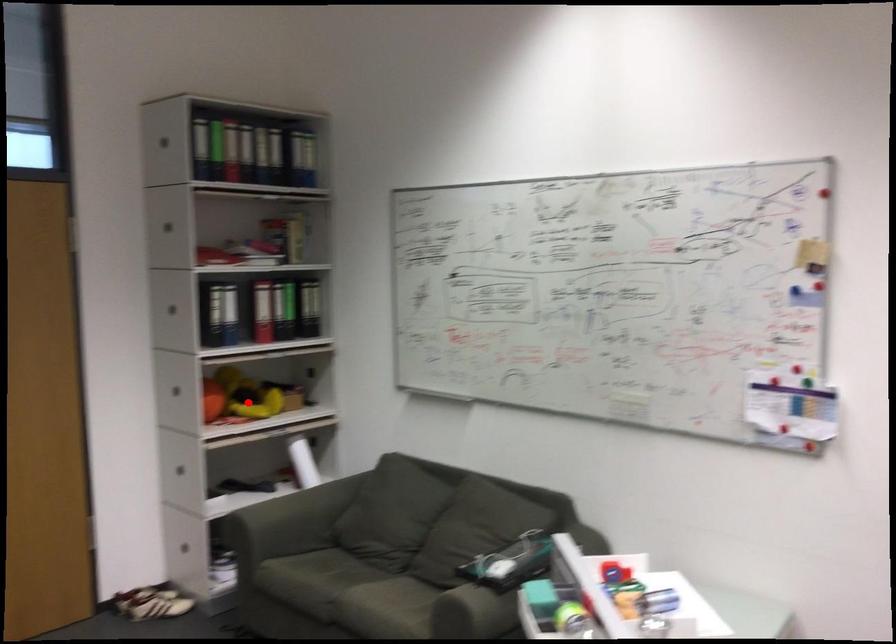
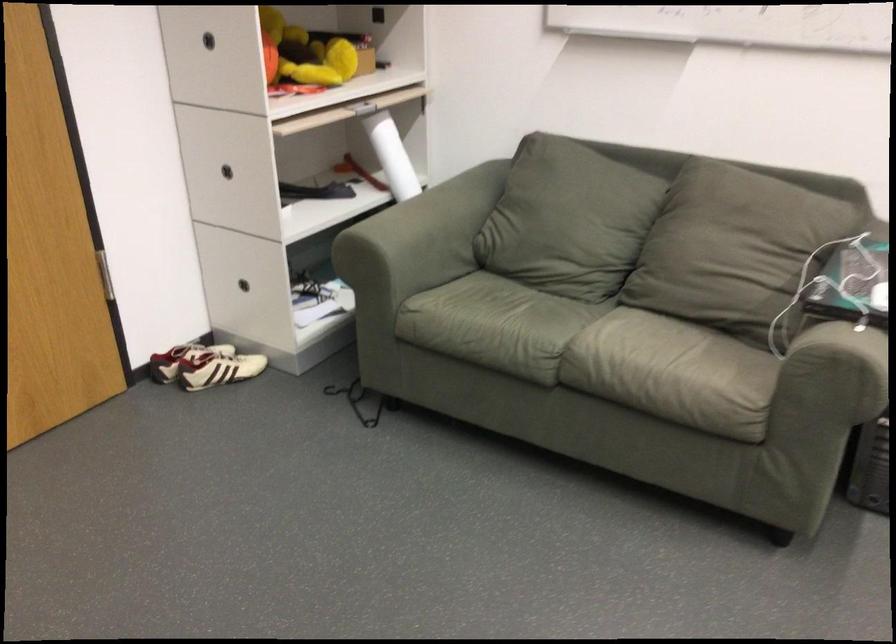
The point at the highlighted location is marked in the first image. Where is the corresponding point in the second image?

(303, 53)